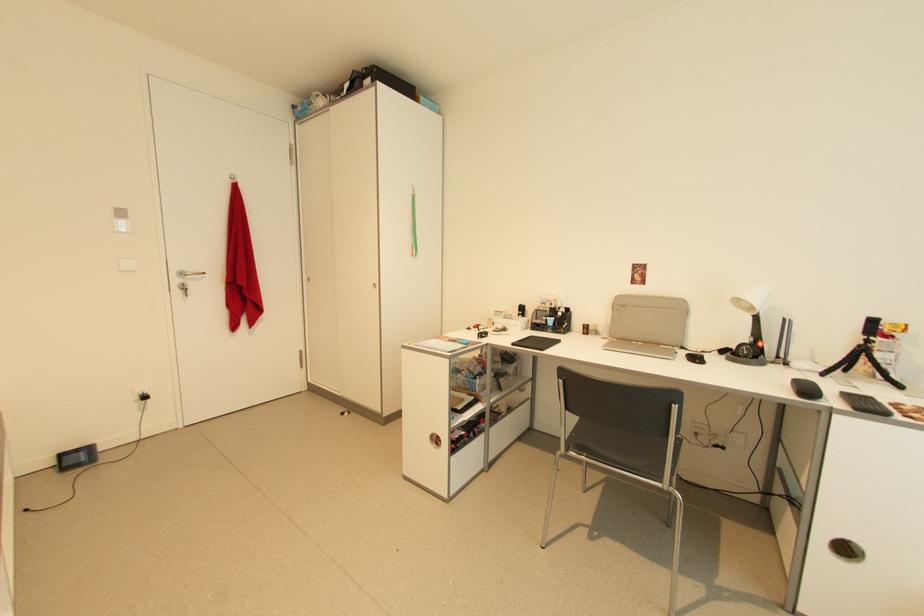
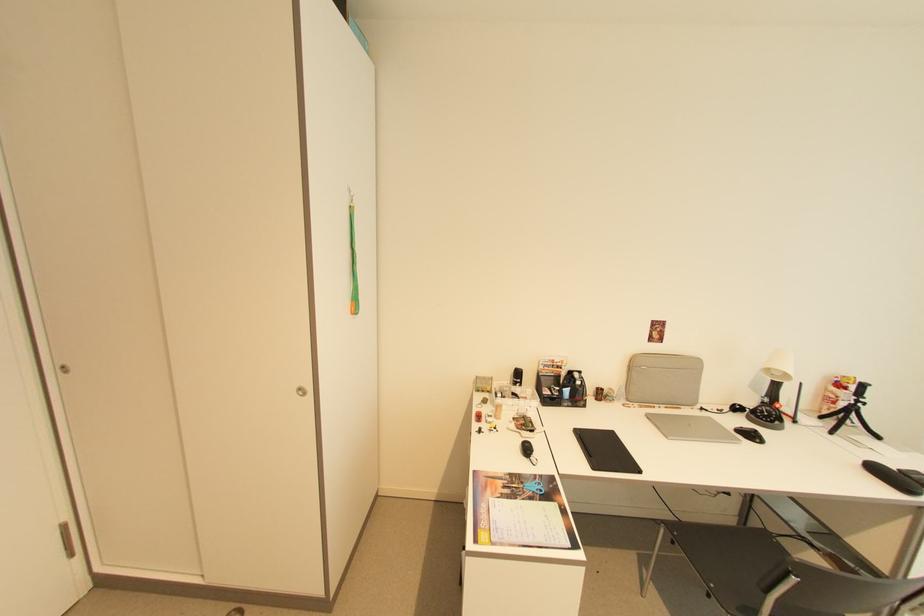
In the second image, find the point that corresponds to (625,307) in the first image.

(638, 366)